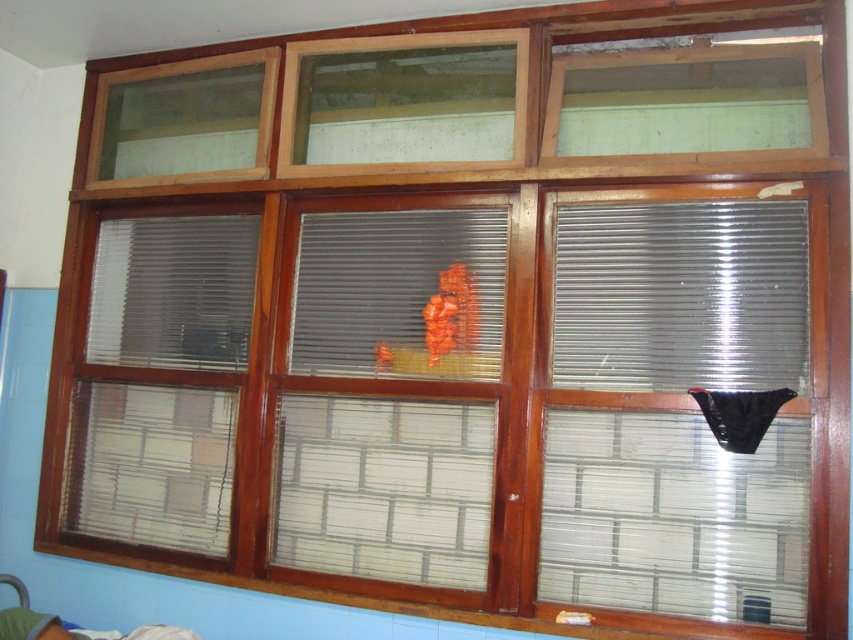
Question: Which is farther from the green fabric bed at lower left?

Choices:
 (A) metallic corrugated blind at right
 (B) translucent plastic blind at center

Answer: (A)

Question: Is metallic corrugated blind at right positioned in front of translucent plastic blind at center?

Choices:
 (A) yes
 (B) no

Answer: (A)

Question: Does translucent plastic blind at center appear on the left side of green fabric bed at lower left?

Choices:
 (A) yes
 (B) no

Answer: (B)

Question: Which is nearer to the translucent plastic blind at center?

Choices:
 (A) metallic corrugated blind at right
 (B) green fabric bed at lower left

Answer: (A)

Question: Is translucent plastic blind at center bigger than green fabric bed at lower left?

Choices:
 (A) no
 (B) yes

Answer: (B)

Question: Which is farther from the green fabric bed at lower left?

Choices:
 (A) metallic corrugated blind at right
 (B) translucent plastic blind at center

Answer: (A)